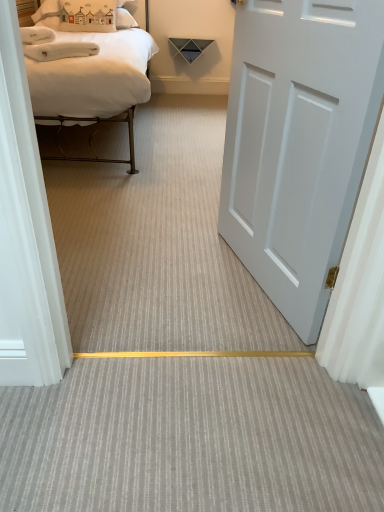
Question: In terms of size, does white fabric pillow at upper left appear bigger or smaller than white matte door at right?

Choices:
 (A) big
 (B) small

Answer: (B)

Question: Is white fabric pillow at upper left inside the boundaries of white matte door at right, or outside?

Choices:
 (A) inside
 (B) outside

Answer: (B)

Question: Considering the real-world distances, which object is closest to the white matte door at right?

Choices:
 (A) gray textured carpet at center
 (B) white matte bed at upper left
 (C) white fabric pillow at upper left

Answer: (A)

Question: Which of these objects is positioned farthest from the white matte bed at upper left?

Choices:
 (A) gray textured carpet at center
 (B) white matte door at right
 (C) white fabric pillow at upper left

Answer: (A)